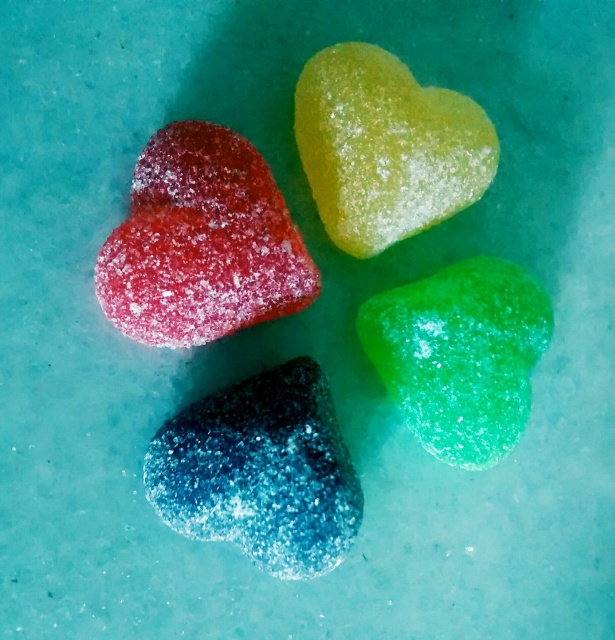
Question: Can you confirm if blue glittery heart at bottom left is positioned below translucent yellow heart at upper center?

Choices:
 (A) yes
 (B) no

Answer: (A)

Question: Does blue glittery heart at bottom left have a smaller size compared to translucent yellow heart at upper center?

Choices:
 (A) no
 (B) yes

Answer: (A)

Question: Is the position of translucent yellow heart at upper center less distant than that of green glittery heart at bottom right?

Choices:
 (A) no
 (B) yes

Answer: (B)

Question: Which is farther from the green glittery heart at bottom right?

Choices:
 (A) blue glittery heart at bottom left
 (B) translucent yellow heart at upper center
 (C) matte red heart at upper left

Answer: (C)

Question: Which of the following is the farthest from the observer?

Choices:
 (A) (410, 230)
 (B) (467, 364)
 (C) (196, 524)

Answer: (A)

Question: Which object appears closest to the camera in this image?

Choices:
 (A) blue glittery heart at bottom left
 (B) translucent yellow heart at upper center
 (C) matte red heart at upper left
 (D) green glittery heart at bottom right

Answer: (A)